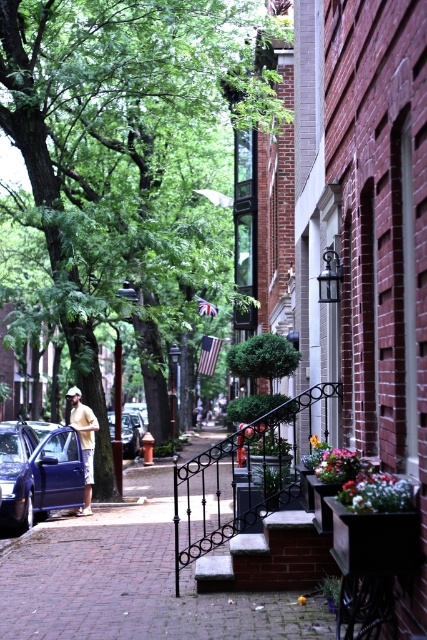
Question: Does green leafy tree at upper left appear over brick pavement at lower center?

Choices:
 (A) yes
 (B) no

Answer: (A)

Question: Is brick stairs at center above light yellow shirt at center?

Choices:
 (A) yes
 (B) no

Answer: (A)

Question: Considering the real-world distances, which object is farthest from the green leafy tree at upper left?

Choices:
 (A) brick stairs at center
 (B) light yellow shirt at center

Answer: (A)

Question: Estimate the real-world distances between objects in this image. Which object is farther from the green leafy tree at upper left?

Choices:
 (A) brick stairs at center
 (B) metallic silver car at center
 (C) brick pavement at lower center
 (D) matte blue car at left

Answer: (A)

Question: Among these objects, which one is nearest to the camera?

Choices:
 (A) green leafy tree at upper left
 (B) metallic silver car at center
 (C) matte blue car at left

Answer: (C)

Question: Is green leafy tree at upper left positioned at the back of light yellow shirt at center?

Choices:
 (A) no
 (B) yes

Answer: (A)